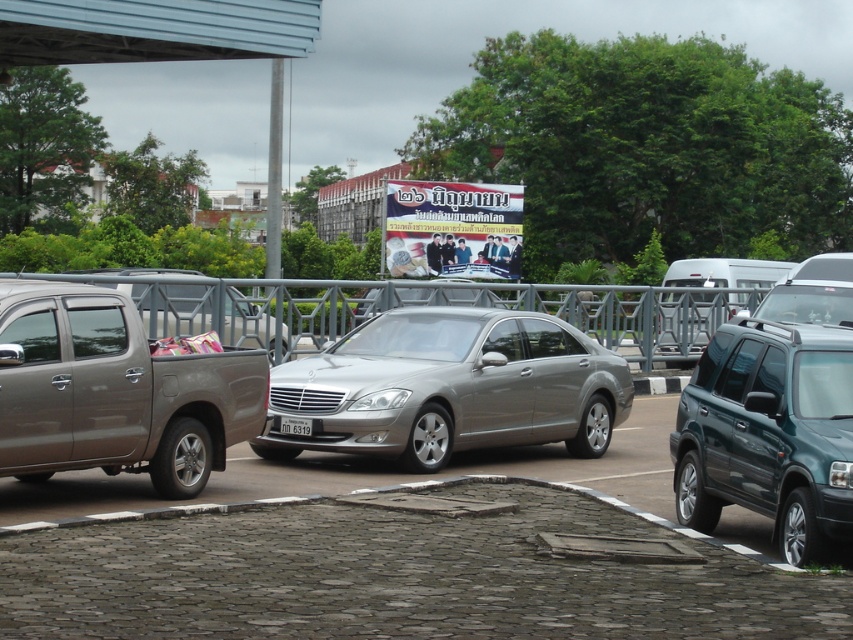
Question: Which of the following is the farthest from the observer?

Choices:
 (A) (293, 419)
 (B) (171, 444)
 (C) (386, 381)

Answer: (A)

Question: Can you confirm if satin silver sedan at center is thinner than metallic green suv at right?

Choices:
 (A) yes
 (B) no

Answer: (B)

Question: Considering the relative positions of matte metallic truck at left and metallic green suv at right in the image provided, where is matte metallic truck at left located with respect to metallic green suv at right?

Choices:
 (A) left
 (B) right

Answer: (A)

Question: Which is farther from the white plastic license plate at center?

Choices:
 (A) matte metallic truck at left
 (B) metallic green suv at right
 (C) satin silver sedan at center

Answer: (B)

Question: Which is nearer to the matte metallic truck at left?

Choices:
 (A) satin silver sedan at center
 (B) white plastic license plate at center
 (C) metallic green suv at right

Answer: (B)

Question: Can you confirm if matte metallic truck at left is smaller than white plastic license plate at center?

Choices:
 (A) yes
 (B) no

Answer: (B)